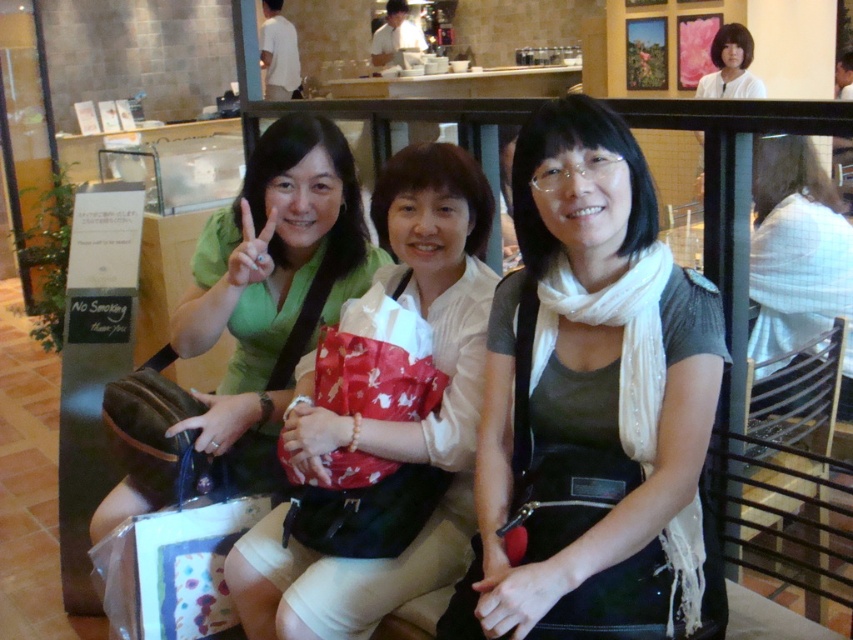
Question: Which of the following is the farthest from the observer?

Choices:
 (A) (805, 204)
 (B) (445, 560)
 (C) (492, 413)

Answer: (A)

Question: Considering the relative positions of matte green blouse at center and white fabric shirt at upper right in the image provided, where is matte green blouse at center located with respect to white fabric shirt at upper right?

Choices:
 (A) right
 (B) left

Answer: (B)

Question: Is white satin scarf at center smaller than white fabric shirt at upper right?

Choices:
 (A) yes
 (B) no

Answer: (A)

Question: Considering the relative positions of matte green blouse at center and white fabric shirt at upper right in the image provided, where is matte green blouse at center located with respect to white fabric shirt at upper right?

Choices:
 (A) right
 (B) left

Answer: (B)

Question: Which of these objects is positioned closest to the matte green blouse at center?

Choices:
 (A) white fabric shirt at upper right
 (B) white satin scarf at center

Answer: (B)

Question: Which of the following is the closest to the observer?

Choices:
 (A) white fabric shirt at upper right
 (B) white satin scarf at center
 (C) matte green blouse at center

Answer: (B)